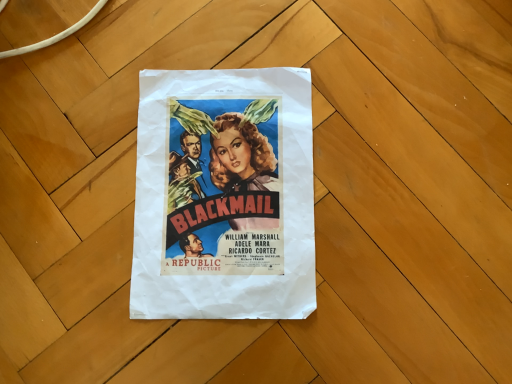
This screenshot has width=512, height=384. Describe the element at coordinates (224, 195) in the screenshot. I see `matte paper poster at center` at that location.

At what (x,y) coordinates should I click in order to perform the action: click on matte paper poster at center. Please return your answer as a coordinate pair (x, y). The image size is (512, 384). Looking at the image, I should click on (224, 195).

In order to click on matte paper poster at center in this screenshot , I will do `click(224, 195)`.